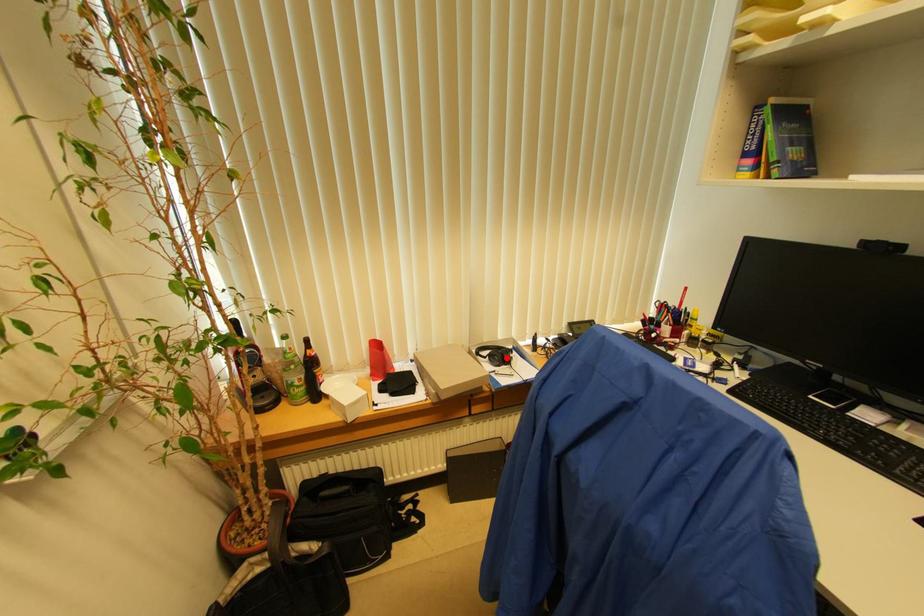
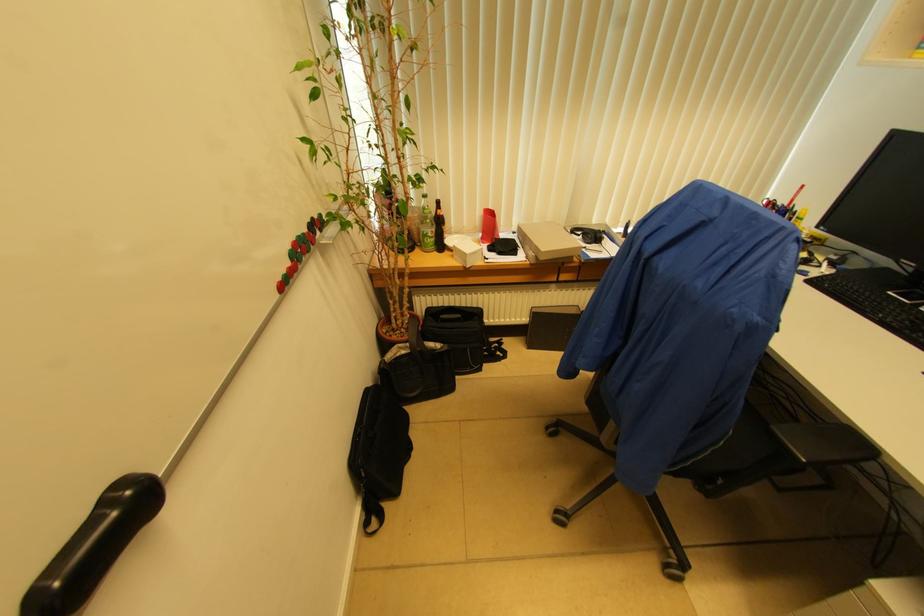
Question: I am providing you with two images of the same scene from different viewpoints. A red point is marked on the first image. Is the red point's position out of view in image 2?

Choices:
 (A) Yes
 (B) No

Answer: (B)